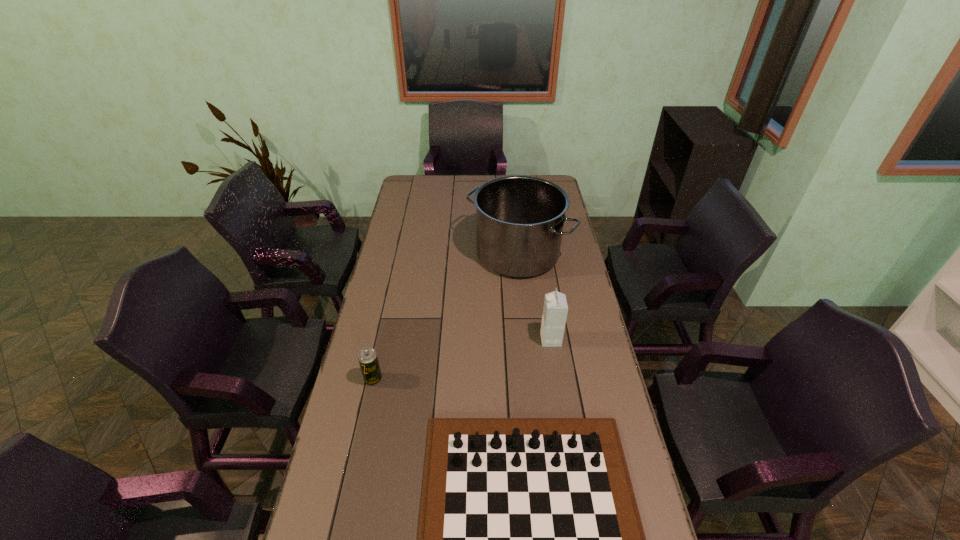
This screenshot has width=960, height=540. I want to click on vacant space in between the saucepan and the beer can, so click(445, 316).

Identify the location of free point between the third farthest object and the second farthest object. This screenshot has height=540, width=960. (462, 360).

The image size is (960, 540). Identify the location of blank region between the leftmost object and the carton. (462, 360).

This screenshot has width=960, height=540. Find the location of `free space between the leftmost object and the tallest object`. free space between the leftmost object and the tallest object is located at coordinates (445, 316).

Choose which object is the second nearest neighbor to the saucepan. Please provide its 2D coordinates. Your answer should be formatted as a tuple, i.e. [(x, y)], where the tuple contains the x and y coordinates of a point satisfying the conditions above.

[(367, 357)]

Identify which object is located as the second nearest to the shortest object. Please provide its 2D coordinates. Your answer should be formatted as a tuple, i.e. [(x, y)], where the tuple contains the x and y coordinates of a point satisfying the conditions above.

[(555, 309)]

This screenshot has height=540, width=960. In order to click on vacant space that satisfies the following two spatial constraints: 1. on the front label of the third shortest object; 2. on the front side of the leftmost object in this screenshot , I will do `click(557, 379)`.